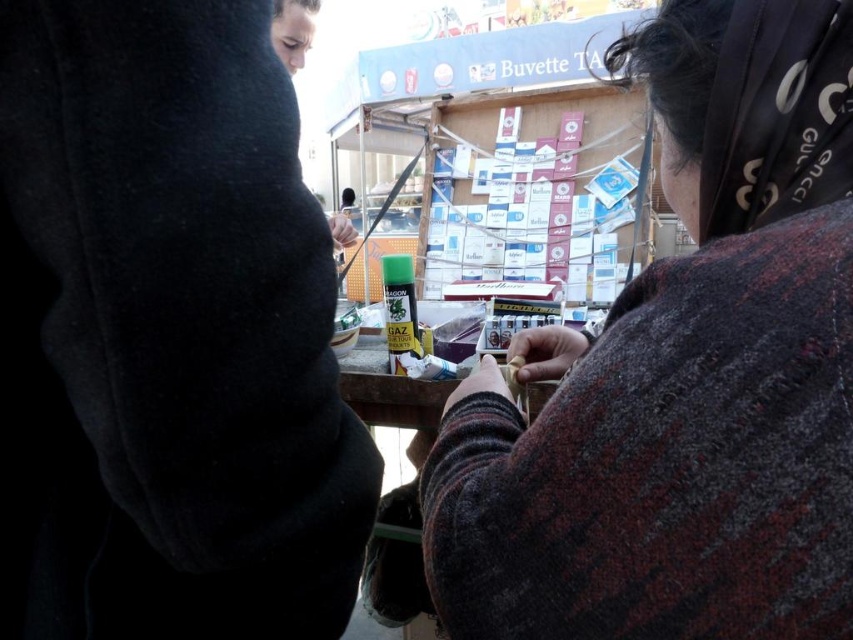
You are a customer at the market and want to buy the knitted wool sweater at center and the black fabric headscarf at upper right. The vendor tells you that the item that is taller is on sale. Which item should you ask about?

The knitted wool sweater at center is taller than the black fabric headscarf at upper right, so you should ask about the knitted wool sweater at center.

Looking at this image, you are a photographer trying to capture both the black fleece sweatshirt at left and the black fabric headscarf at upper right in a single frame. Based on their positions and sizes, do you think you can fit both into the camera view without moving the camera?

The black fleece sweatshirt at left might be wider than black fabric headscarf at upper right, so there is a possibility that the black fleece sweatshirt at left could occupy more horizontal space. However, without knowing the exact dimensions of the camera view or the distance between them, it is uncertain if both can fit without moving the camera.